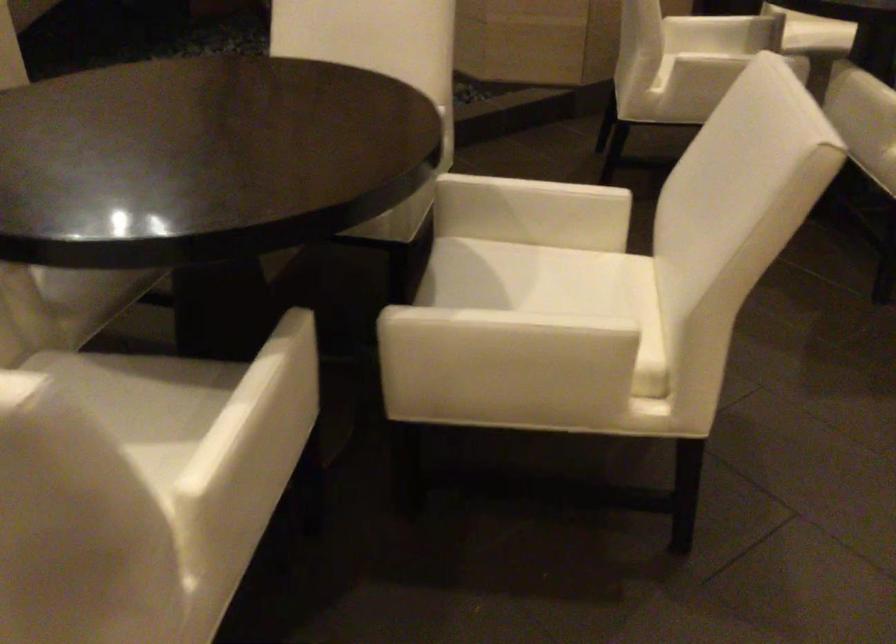
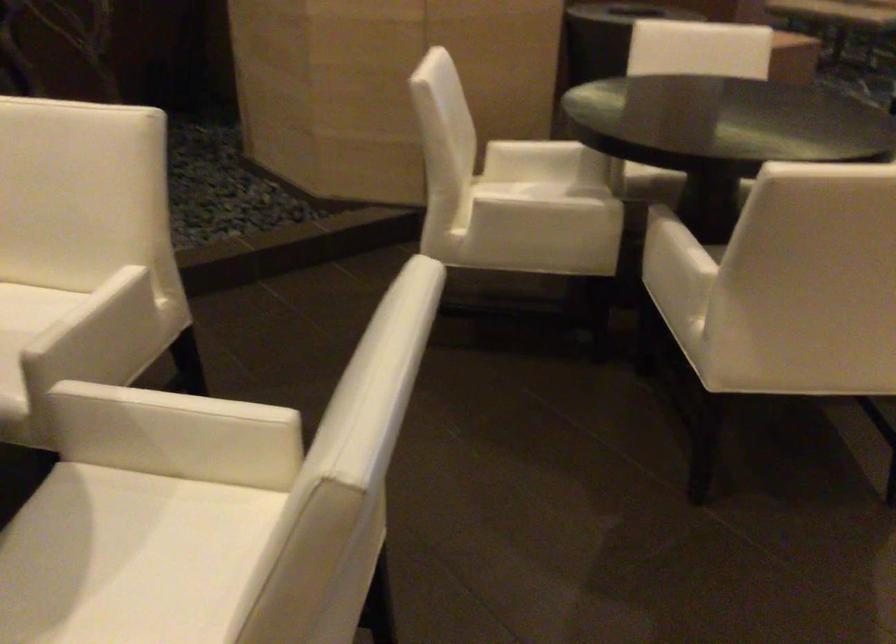
Which direction would the cameraman need to move to produce the second image?

The cameraman moved toward right, forward.